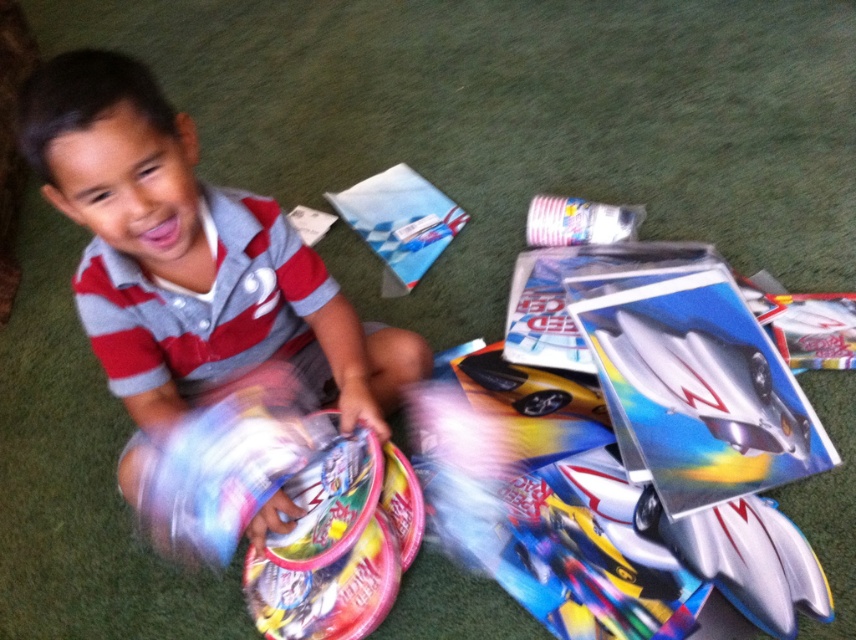
Who is more distant from viewer, (153, 307) or (640, 326)?

The point (640, 326) is behind.

Is point (153, 113) more distant than point (718, 368)?

No, (153, 113) is in front of (718, 368).

At what (x,y) coordinates should I click in order to perform the action: click on matte gray shirt at center. Please return your answer as a coordinate pair (x, y). Image resolution: width=856 pixels, height=640 pixels. Looking at the image, I should click on (189, 260).

Who is more forward, (x=753, y=369) or (x=331, y=588)?

Positioned in front is point (x=331, y=588).

Is metallic silver toy car at center above glossy plastic toy at lower left?

Indeed, metallic silver toy car at center is positioned over glossy plastic toy at lower left.

What do you see at coordinates (687, 376) in the screenshot? This screenshot has height=640, width=856. I see `metallic silver toy car at center` at bounding box center [687, 376].

At what (x,y) coordinates should I click in order to perform the action: click on metallic silver toy car at center. Please return your answer as a coordinate pair (x, y). Looking at the image, I should click on (687, 376).

Between matte gray shirt at center and glossy plastic toy at lower left, which one appears on the left side from the viewer's perspective?

matte gray shirt at center

Between matte gray shirt at center and glossy plastic toy at lower left, which one has more height?

matte gray shirt at center

Which is behind, point (188, 275) or point (349, 628)?

The point (349, 628) is more distant.

This screenshot has width=856, height=640. Identify the location of matte gray shirt at center. (189, 260).